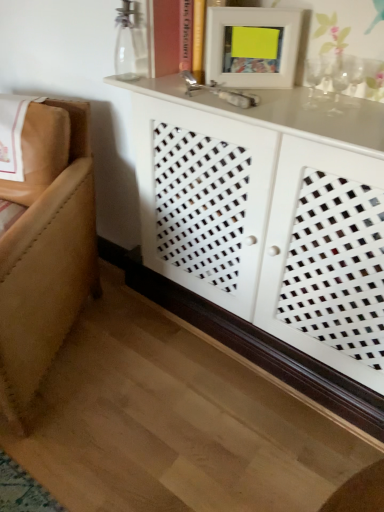
Question: Does point (79, 201) appear closer or farther from the camera than point (225, 56)?

Choices:
 (A) farther
 (B) closer

Answer: (A)

Question: Is tan leather couch at left wider or thinner than white matte picture frame at upper center?

Choices:
 (A) thin
 (B) wide

Answer: (B)

Question: Considering the real-world distances, which object is closest to the clear glass vase at upper center?

Choices:
 (A) white lattice cabinet at center
 (B) white matte picture frame at upper center
 (C) tan leather couch at left

Answer: (B)

Question: Which object is the farthest from the white lattice cabinet at center?

Choices:
 (A) clear glass vase at upper center
 (B) white matte picture frame at upper center
 (C) tan leather couch at left

Answer: (A)